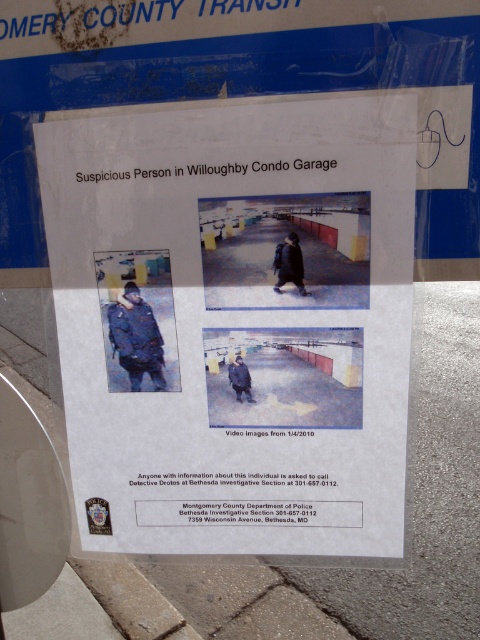
You are a person standing in front of the notice. You want to touch both the white paper at center and the gray concrete pavement at lower center. Which one will you need to reach out further to touch?

The gray concrete pavement at lower center is further away from the viewer than the white paper at center, so you will need to reach out further to touch the gray concrete pavement at lower center.

You are a delivery person who needs to deliver a package to the manager of Willoughby Condo. You are currently standing in front of the wall where the notice is posted. To ensure you deliver the package correctly, you must locate the white paper at center. Where exactly should you look on the wall to find it?

The white paper at center is located at the coordinates point (235, 323), so you should look at that specific point on the wall to find it.